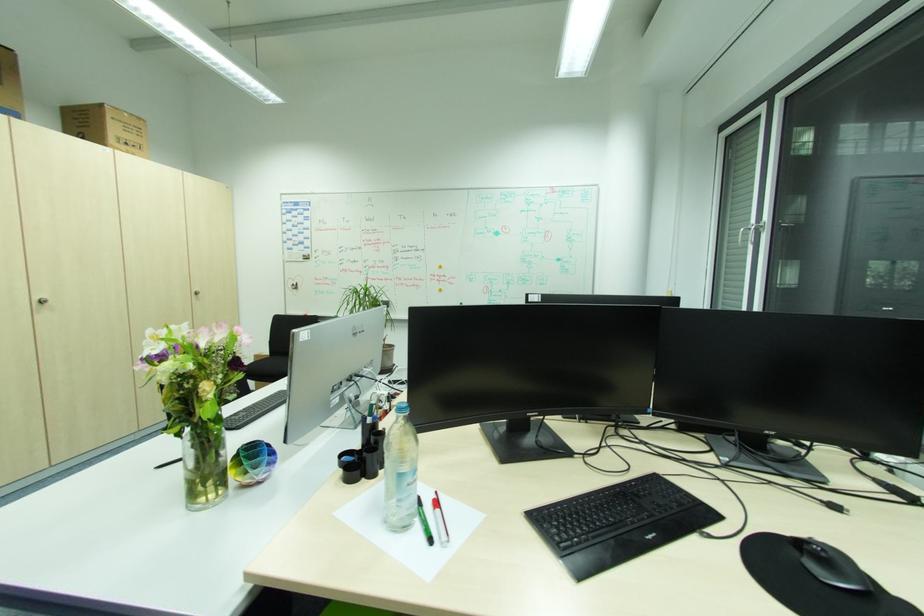
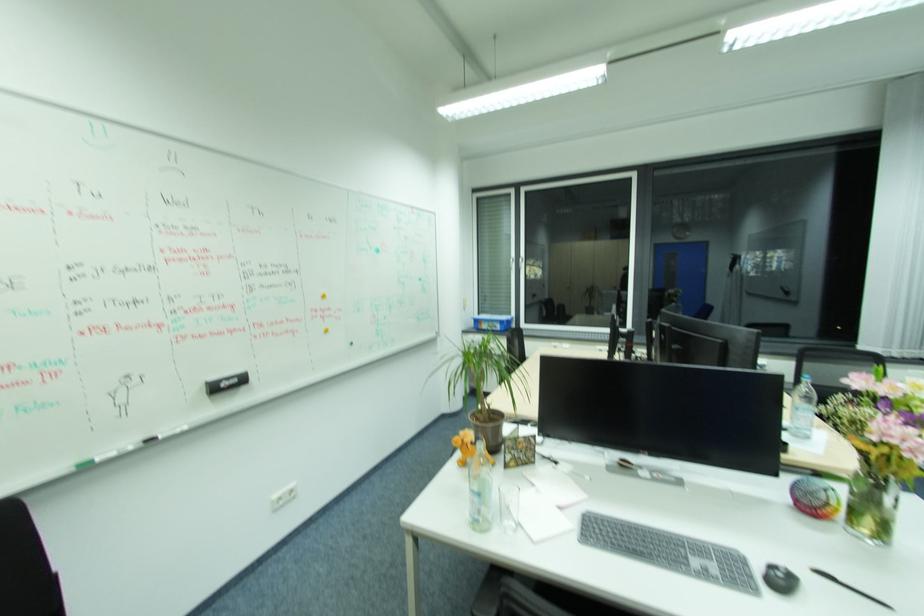
In the second image, find the point that corresponds to pixel 445 267 in the first image.

(329, 296)